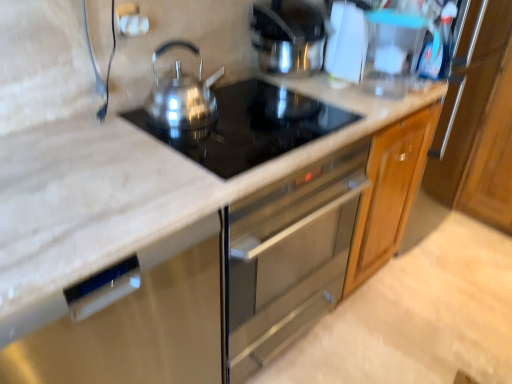
Locate an element on the screen. This screenshot has width=512, height=384. empty space that is ontop of black marble countertop at center (from a real-world perspective) is located at coordinates (271, 125).